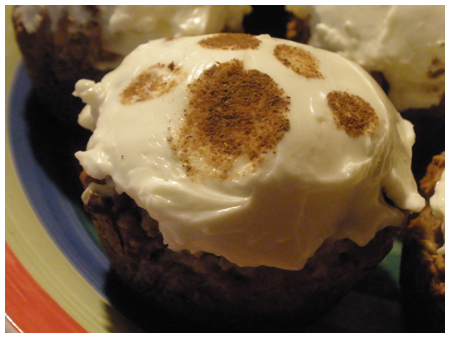
The width and height of the screenshot is (450, 338). What are the coordinates of `plate` in the screenshot? It's located at (23, 220).